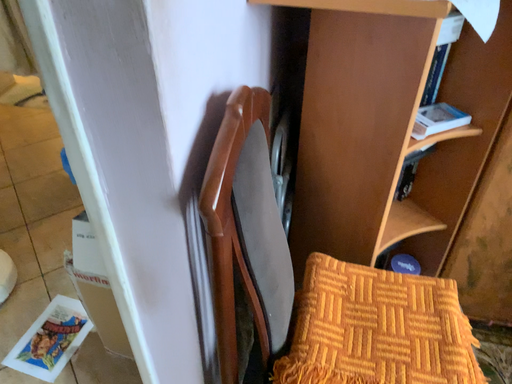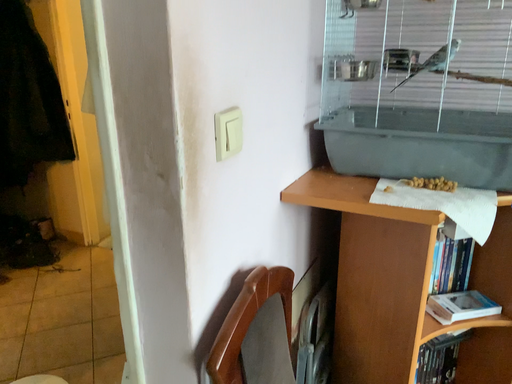
Question: Which way did the camera rotate in the video?

Choices:
 (A) rotated downward
 (B) rotated upward

Answer: (B)